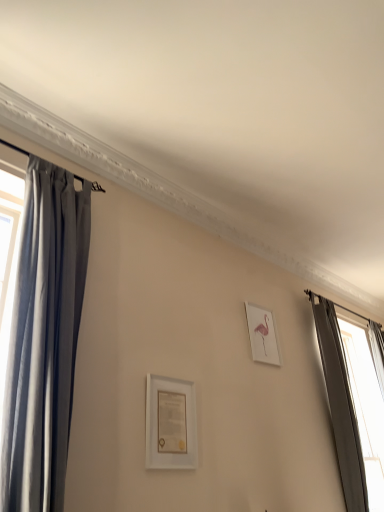
Question: Could you tell me if white matte picture frame at center, which appears as the 1th picture frame when viewed from the left, is turned towards silky gray curtain at left, positioned as the second curtain in back-to-front order?

Choices:
 (A) yes
 (B) no

Answer: (B)

Question: Considering the relative positions of white matte picture frame at center, which appears as the 1th picture frame when viewed from the left, and silky gray curtain at left, positioned as the second curtain in back-to-front order, in the image provided, is white matte picture frame at center, which appears as the 1th picture frame when viewed from the left, to the left of silky gray curtain at left, positioned as the second curtain in back-to-front order, from the viewer's perspective?

Choices:
 (A) no
 (B) yes

Answer: (A)

Question: Can you confirm if white matte picture frame at center, which appears as the 1th picture frame when viewed from the left, is smaller than silky gray curtain at left, positioned as the second curtain in back-to-front order?

Choices:
 (A) yes
 (B) no

Answer: (A)

Question: Is silky gray curtain at left, which ranks as the first curtain in front-to-back order, at the back of white matte picture frame at center, placed as the second picture frame when sorted from right to left?

Choices:
 (A) no
 (B) yes

Answer: (A)

Question: From the image's perspective, does white matte picture frame at center, the 2th picture frame when ordered from back to front, appear lower than silky gray curtain at left, the second curtain from the right?

Choices:
 (A) no
 (B) yes

Answer: (B)

Question: Does white matte picture frame at center, which appears as the 1th picture frame when viewed from the left, come behind silky gray curtain at left, the second curtain from the right?

Choices:
 (A) yes
 (B) no

Answer: (A)

Question: Is dark gray fabric curtain at right, the second curtain in the left-to-right sequence, aimed at pink paper at upper right, which is the second picture frame from front to back?

Choices:
 (A) yes
 (B) no

Answer: (B)

Question: Can you confirm if dark gray fabric curtain at right, the second curtain viewed from the front, is taller than pink paper at upper right, which ranks as the second picture frame in left-to-right order?

Choices:
 (A) no
 (B) yes

Answer: (B)

Question: Considering the relative sizes of dark gray fabric curtain at right, the second curtain viewed from the front, and pink paper at upper right, which is the second picture frame from front to back, in the image provided, is dark gray fabric curtain at right, the second curtain viewed from the front, shorter than pink paper at upper right, which is the second picture frame from front to back,?

Choices:
 (A) yes
 (B) no

Answer: (B)

Question: Is dark gray fabric curtain at right, acting as the 1th curtain starting from the right, positioned in front of pink paper at upper right, which is the first picture frame in back-to-front order?

Choices:
 (A) no
 (B) yes

Answer: (B)

Question: Is dark gray fabric curtain at right, acting as the 1th curtain starting from the right, thinner than pink paper at upper right, which ranks as the second picture frame in left-to-right order?

Choices:
 (A) no
 (B) yes

Answer: (A)

Question: From a real-world perspective, is dark gray fabric curtain at right, the second curtain viewed from the front, physically below pink paper at upper right, which ranks as the second picture frame in left-to-right order?

Choices:
 (A) yes
 (B) no

Answer: (A)

Question: Can you confirm if pink paper at upper right, which ranks as the second picture frame in left-to-right order, is smaller than dark gray fabric curtain at right, the second curtain viewed from the front?

Choices:
 (A) no
 (B) yes

Answer: (B)